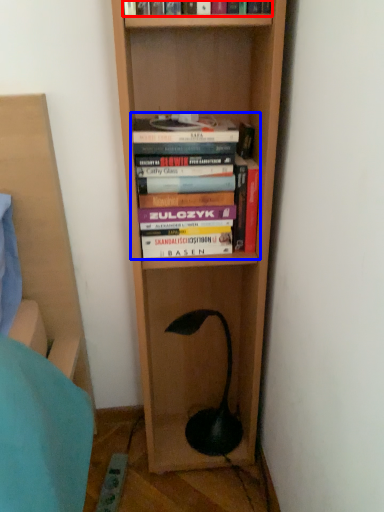
Question: Which object is further to the camera taking this photo, book (highlighted by a red box) or book (highlighted by a blue box)?

Choices:
 (A) book
 (B) book

Answer: (B)